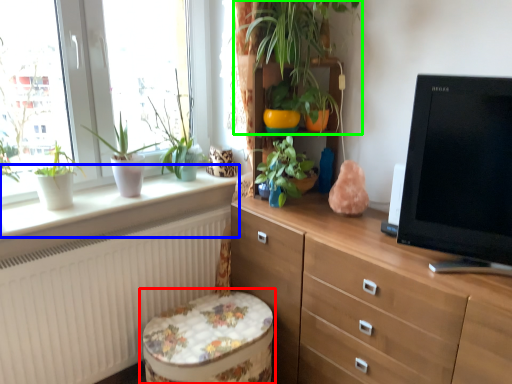
Question: Which object is the closest to the music stool (highlighted by a red box)? Choose among these: window sill (highlighted by a blue box) or houseplant (highlighted by a green box).

Choices:
 (A) window sill
 (B) houseplant

Answer: (A)